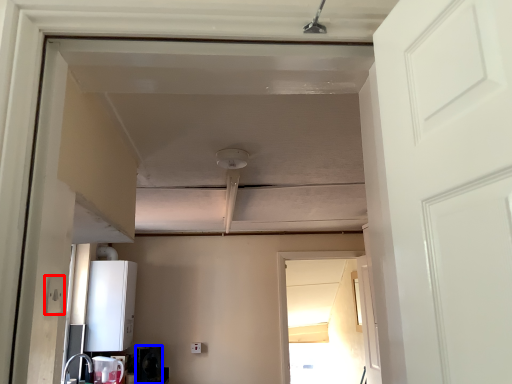
Question: Which object is closer to the camera taking this photo, electric outlet (highlighted by a red box) or appliance (highlighted by a blue box)?

Choices:
 (A) electric outlet
 (B) appliance

Answer: (A)